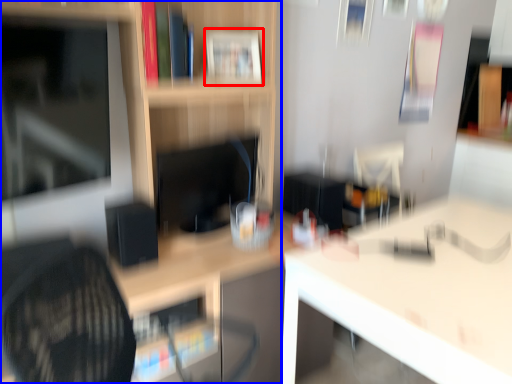
Question: Which of the following is the farthest to the observer, book (highlighted by a red box) or shelf (highlighted by a blue box)?

Choices:
 (A) book
 (B) shelf

Answer: (A)